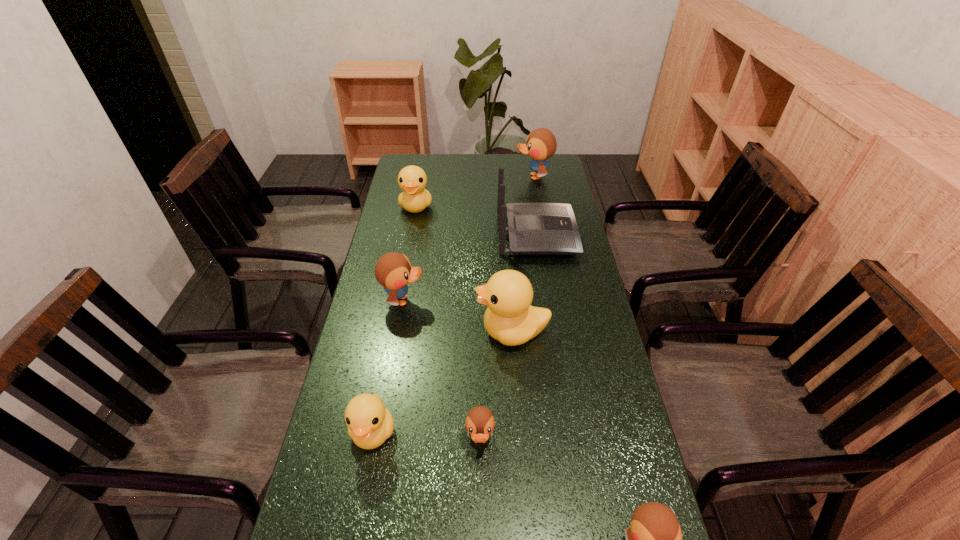
Image resolution: width=960 pixels, height=540 pixels. I want to click on free region located on the face of the nearest yellow duck, so click(x=359, y=508).

The height and width of the screenshot is (540, 960). In order to click on free space located on the front-facing side of the smallest blue duck in this screenshot , I will do `click(480, 480)`.

You are a GUI agent. You are given a task and a screenshot of the screen. Output one action in this format:
    pyautogui.click(x=<x>, y=<y>)
    Task: Click on the object that is at the far edge
    The width and height of the screenshot is (960, 540).
    Given the screenshot: What is the action you would take?
    pyautogui.click(x=541, y=144)

Find the location of `duck positioned at the right edge`. duck positioned at the right edge is located at coordinates (541, 144).

Find the location of a particular element. The width and height of the screenshot is (960, 540). router positioned at the right edge is located at coordinates (534, 228).

The height and width of the screenshot is (540, 960). In order to click on object located in the far right corner section of the desktop in this screenshot , I will do `click(541, 144)`.

In the image, there is a desktop. Where is `vacant space at the far edge`? Image resolution: width=960 pixels, height=540 pixels. vacant space at the far edge is located at coordinates (453, 159).

The image size is (960, 540). In order to click on vacant region at the left edge in this screenshot , I will do `click(396, 211)`.

Image resolution: width=960 pixels, height=540 pixels. Find the location of `free space at the right edge`. free space at the right edge is located at coordinates (564, 390).

Identify the location of empty space that is in between the farthest blue duck and the smallest yellow duck. (454, 304).